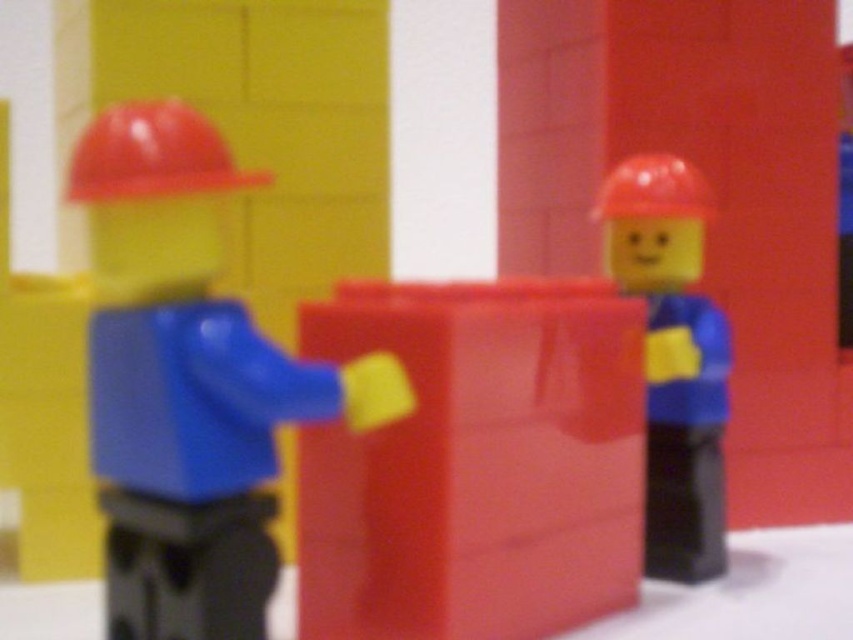
You are a toy figure trying to place a small toy car between the matte plastic cube at center and the matte plastic hat at center. Can the car fit between them if the car is 10 cm long?

The matte plastic cube at center might be wider than matte plastic hat at center, but the exact width difference isn

You are a construction worker looking at the scene. Which object is positioned lower between the matte plastic construction worker at left and the matte plastic hard hat at upper left?

The matte plastic construction worker at left is positioned lower than the matte plastic hard hat at upper left.

You are a child trying to build a tower using the toys in the image. You have the matte plastic construction worker at left and the matte plastic hard hat at upper left. Which object can you use to place on top of the tower to make it stable?

The matte plastic construction worker at left is larger in size compared to the matte plastic hard hat at upper left, so it would provide a more stable base or top for the tower.